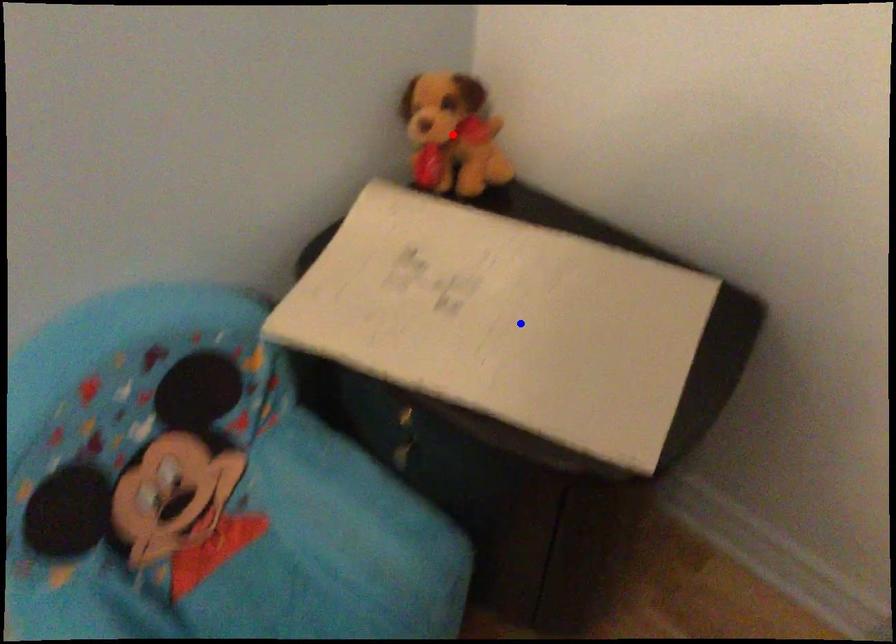
Question: In the image, two points are highlighted. Which point is nearer to the camera? Reply with the corresponding letter.

Choices:
 (A) blue point
 (B) red point

Answer: (A)